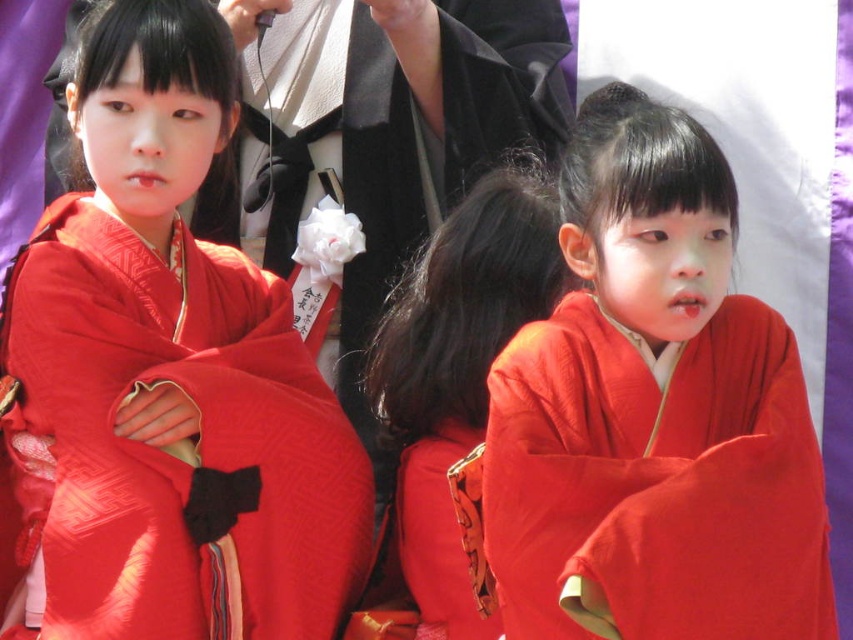
You are an artist trying to paint the scene. You need to place a point at coordinates point (170, 374). Where should you place it?

The point (170, 374) should be placed on the matte kimono at center.

You are organizing a traditional Japanese festival and need to decide which kimono to display. Given that the matte red kimono at center and the silky red kimono at center are both available, which one would be more appropriate for a larger crowd to see clearly from a distance?

The matte red kimono at center is bigger than the silky red kimono at center, making it more suitable for visibility in a large crowd from a distance.

You are organizing a traditional Japanese festival and need to display two kimonos in the center of the stage. The matte kimono at center and the silky red kimono at center must be arranged so that the larger one is placed behind the smaller one for visual balance. Which kimono should be placed behind the other?

The matte kimono at center should be placed behind the silky red kimono at center since it is larger and this arrangement will create the desired visual balance.